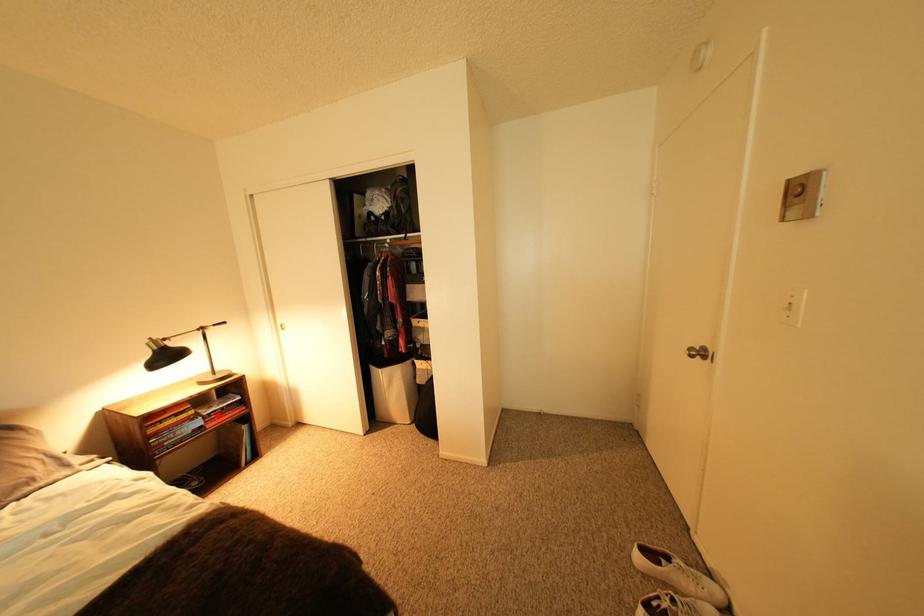
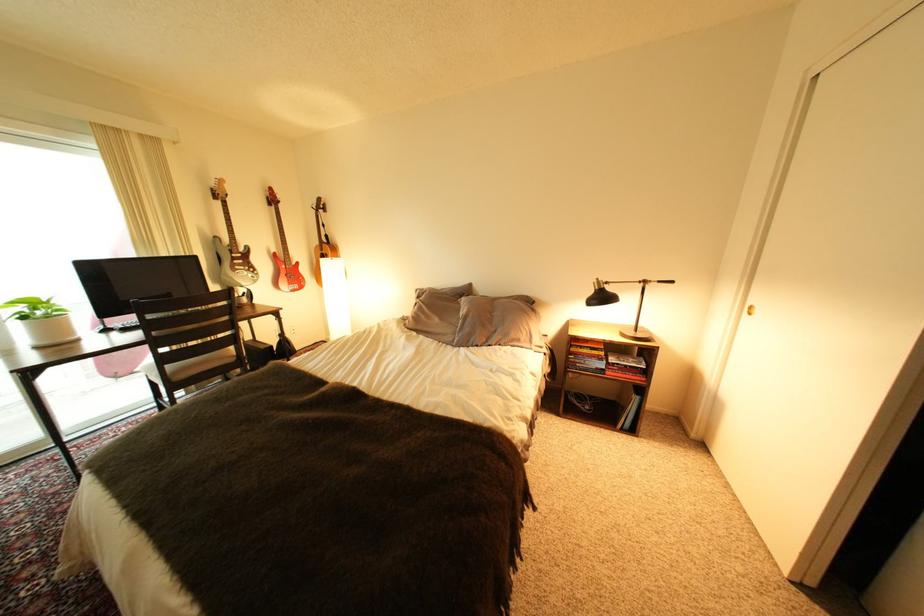
Question: I am providing you with two images of the same scene from different viewpoints. Image1 has a red point marked. In image2, the corresponding 3D location appears at what relative position? Reply with the corresponding letter.

Choices:
 (A) Closer
 (B) Farther

Answer: (B)